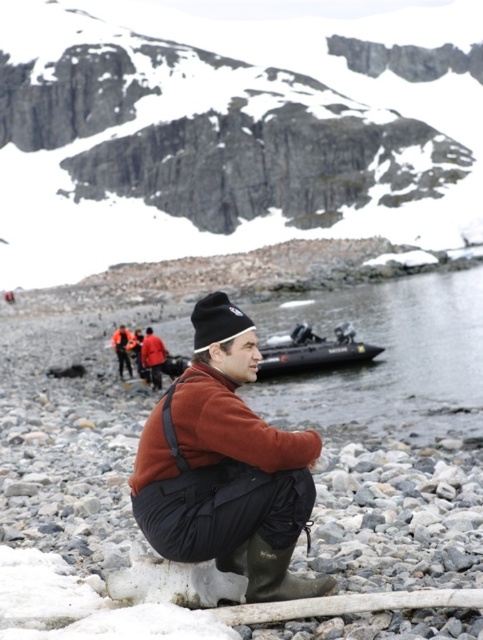
Question: Which point is farther to the camera?

Choices:
 (A) matte brown jacket at center
 (B) rubber inflatable boat at center

Answer: (B)

Question: Is white matte snow at upper center closer to camera compared to rubber inflatable boat at center?

Choices:
 (A) yes
 (B) no

Answer: (B)

Question: Which object appears farthest from the camera in this image?

Choices:
 (A) rubber inflatable boat at center
 (B) white matte snow at upper center

Answer: (B)

Question: Which object appears closest to the camera in this image?

Choices:
 (A) matte brown jacket at center
 (B) white matte snow at upper center
 (C) rubber inflatable boat at center

Answer: (A)

Question: Is white matte snow at upper center smaller than matte brown jacket at center?

Choices:
 (A) yes
 (B) no

Answer: (B)

Question: From the image, what is the correct spatial relationship of white matte snow at upper center in relation to matte brown jacket at center?

Choices:
 (A) below
 (B) above

Answer: (B)